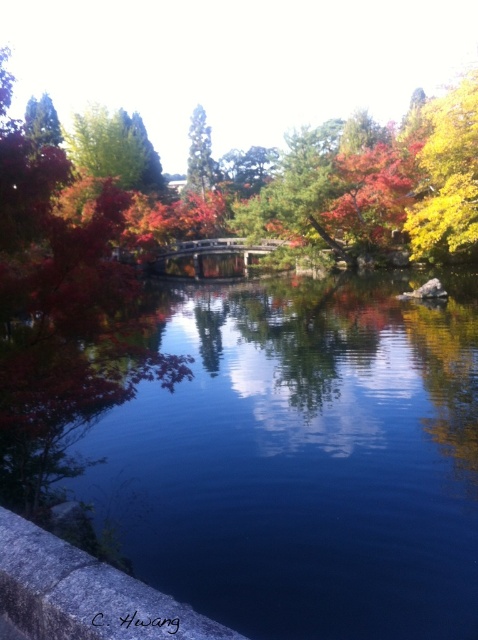
Question: Which of the following is the farthest from the observer?

Choices:
 (A) (319, 403)
 (B) (201, 157)

Answer: (B)

Question: Is blue glassy river at center positioned at the back of green matte tree at upper center?

Choices:
 (A) no
 (B) yes

Answer: (A)

Question: Can you confirm if blue glassy river at center is bigger than green matte tree at upper center?

Choices:
 (A) no
 (B) yes

Answer: (A)

Question: Can you confirm if blue glassy river at center is positioned above green matte tree at upper center?

Choices:
 (A) no
 (B) yes

Answer: (A)